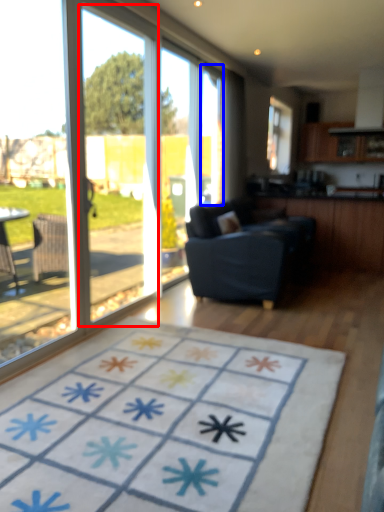
Question: Which of the following is the farthest to the observer, screen door (highlighted by a red box) or window screen (highlighted by a blue box)?

Choices:
 (A) screen door
 (B) window screen

Answer: (B)